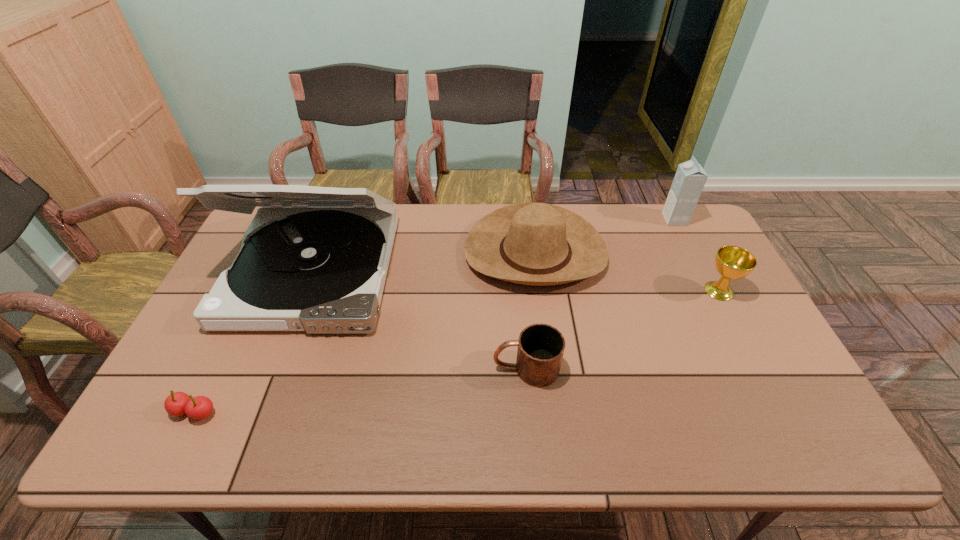
Identify the location of object that ranks as the fourth closest to the tallest object. The width and height of the screenshot is (960, 540). (690, 178).

Locate an element on the screen. The height and width of the screenshot is (540, 960). object identified as the closest to the chalice is located at coordinates (538, 244).

You are a GUI agent. You are given a task and a screenshot of the screen. Output one action in this format:
    pyautogui.click(x=<x>, y=<y>)
    Task: Click on the free space that satisfies the following two spatial constraints: 1. on the front-facing side of the cowboy hat; 2. on the left side of the chalice
    The image size is (960, 540).
    Given the screenshot: What is the action you would take?
    pyautogui.click(x=540, y=291)

The height and width of the screenshot is (540, 960). I want to click on vacant position in the image that satisfies the following two spatial constraints: 1. on the front label of the second tallest object; 2. on the front-facing side of the cowboy hat, so click(x=692, y=253).

The image size is (960, 540). Identify the location of blank area in the image that satisfies the following two spatial constraints: 1. on the front-facing side of the cowboy hat; 2. on the left side of the chalice. (540, 291).

The image size is (960, 540). I want to click on free location that satisfies the following two spatial constraints: 1. on the front label of the fifth shortest object; 2. on the right side of the chalice, so click(710, 291).

Where is `free location that satisfies the following two spatial constraints: 1. on the front-facing side of the third tallest object; 2. on the side of the fifth tallest object with the handle`? Image resolution: width=960 pixels, height=540 pixels. free location that satisfies the following two spatial constraints: 1. on the front-facing side of the third tallest object; 2. on the side of the fifth tallest object with the handle is located at coordinates (550, 368).

You are a GUI agent. You are given a task and a screenshot of the screen. Output one action in this format:
    pyautogui.click(x=<x>, y=<y>)
    Task: Click on the blank space that satisfies the following two spatial constraints: 1. on the front-facing side of the third shortest object; 2. on the left side of the fourth shortest object
    
    Given the screenshot: What is the action you would take?
    pyautogui.click(x=540, y=291)